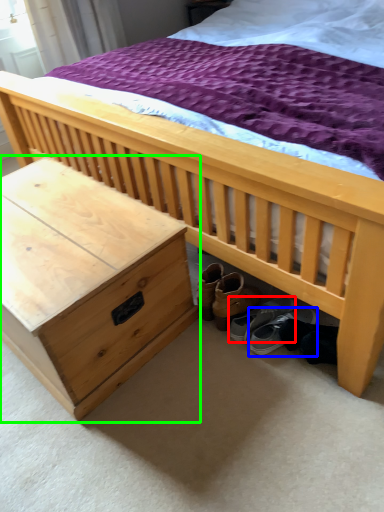
Question: Estimate the real-world distances between objects in this image. Which object is closer to footwear (highlighted by a red box), footwear (highlighted by a blue box) or nightstand (highlighted by a green box)?

Choices:
 (A) footwear
 (B) nightstand

Answer: (A)